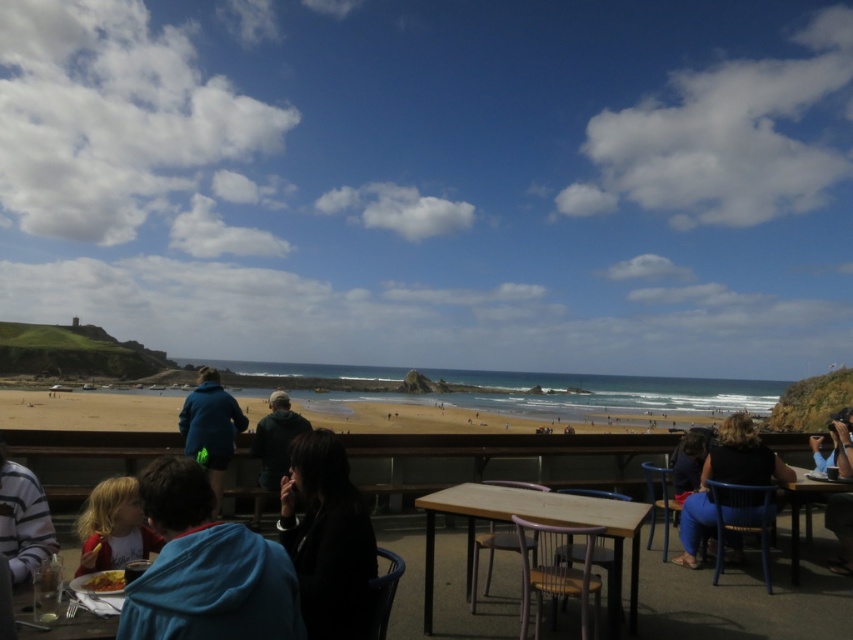
Question: Which object is positioned closest to the black matte jacket at center?

Choices:
 (A) striped sweater at left
 (B) matte red jacket at lower left
 (C) wooden table at lower left

Answer: (B)

Question: Can you confirm if smooth sand beach at center is positioned above blue fabric chair at lower right?

Choices:
 (A) yes
 (B) no

Answer: (B)

Question: Is wooden table at center to the left of blue denim jeans at lower right from the viewer's perspective?

Choices:
 (A) no
 (B) yes

Answer: (B)

Question: Among these points, which one is nearest to the camera?

Choices:
 (A) (746, 432)
 (B) (287, 477)
 (C) (94, 582)
 (D) (19, 632)

Answer: (D)

Question: Where is wooden table at center located in relation to black fabric dress at lower right in the image?

Choices:
 (A) right
 (B) left

Answer: (B)

Question: Among these objects, which one is nearest to the camera?

Choices:
 (A) blue fabric jacket at center
 (B) dark green hoodie at center
 (C) smooth sand beach at center

Answer: (A)